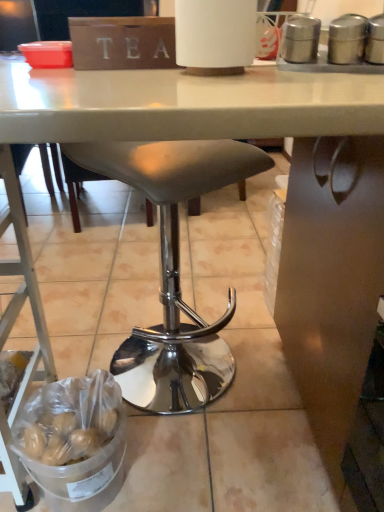
The height and width of the screenshot is (512, 384). I want to click on free spot behind matte gray stool at center, so click(180, 293).